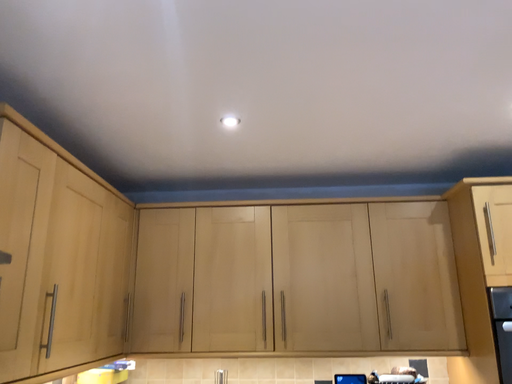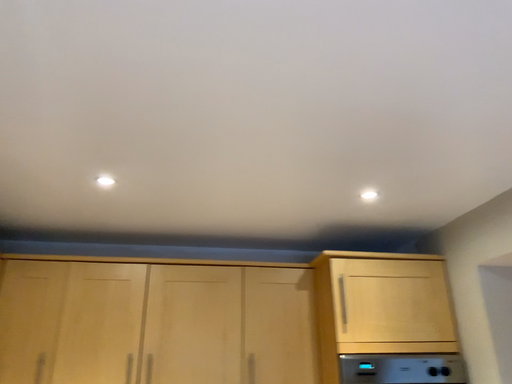
Question: Which way did the camera rotate in the video?

Choices:
 (A) rotated upward
 (B) rotated downward

Answer: (A)